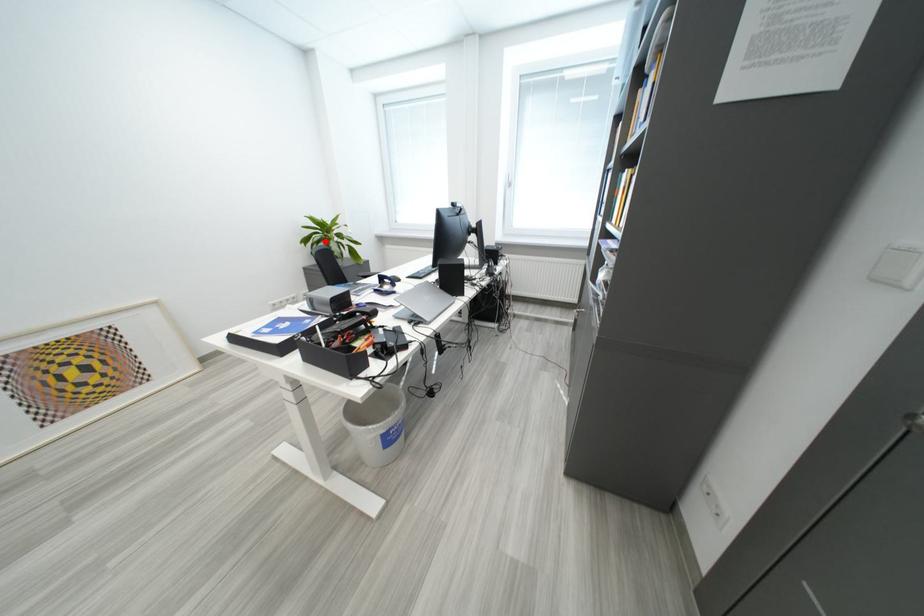
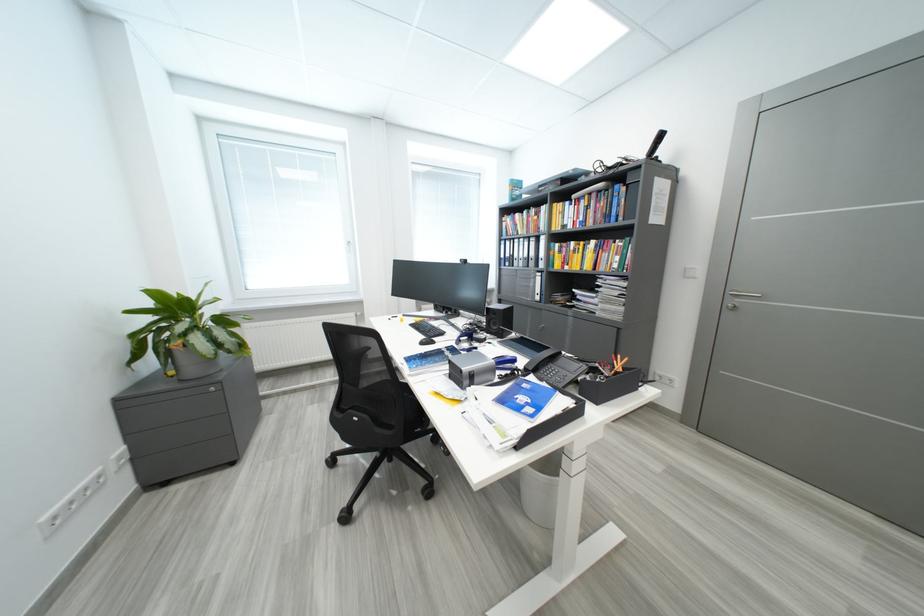
In the second image, find the point that corresponds to the highlighted location in the first image.

(189, 331)